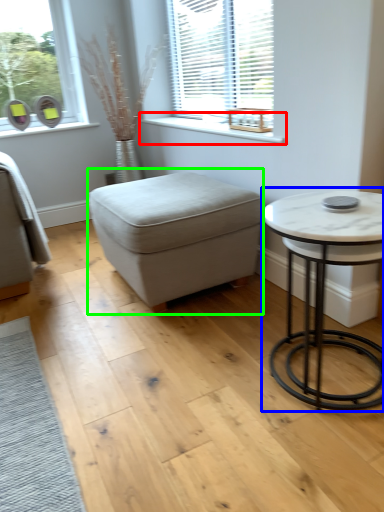
Question: Which object is positioned closest to window sill (highlighted by a red box)? Select from table (highlighted by a blue box) and music stool (highlighted by a green box).

Choices:
 (A) table
 (B) music stool

Answer: (B)